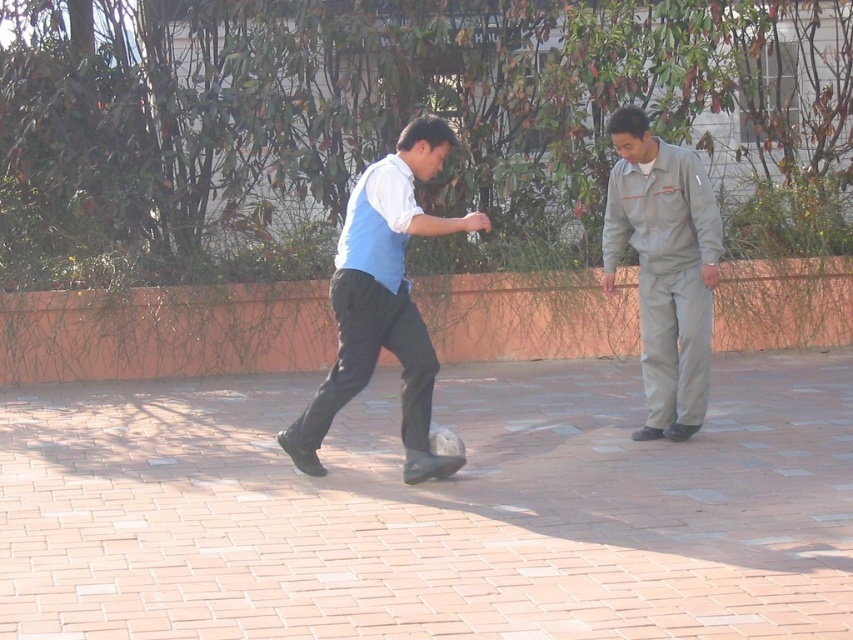
You are a photographer setting up a shot of the two people in the scene. You need to ensure that the matte blue vest at center and the gray uniform at right are both visible in the frame. Given their heights, which object should you focus on first to ensure proper framing?

The matte blue vest at center is taller than the gray uniform at right, so you should focus on the matte blue vest at center first to ensure it is properly framed, as its greater height may require adjusting the camera angle to include both subjects effectively.

You are a photographer trying to capture both the matte blue vest at center and the gray uniform at right in a single frame. Based on their positions, which direction should you move your camera to include both subjects?

Since the matte blue vest at center is to the left of the gray uniform at right, you should move your camera to the left to include both subjects in the frame.

You are a photographer trying to capture both the matte blue vest at center and the gray uniform at right in the same frame. Based on their sizes, which one should you focus on to ensure both are visible clearly?

The matte blue vest at center is larger in size than the gray uniform at right, so you should focus on the matte blue vest at center to ensure both are visible clearly.